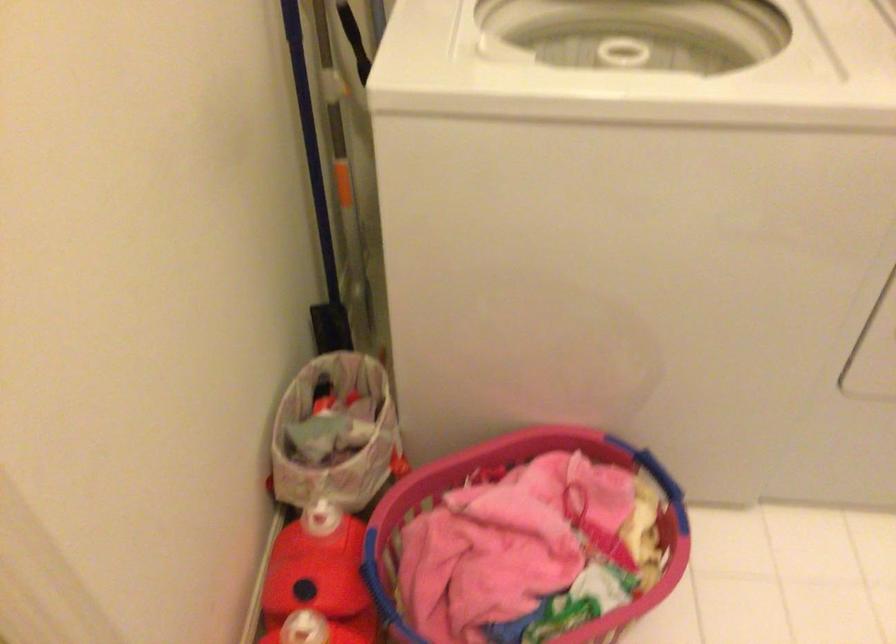
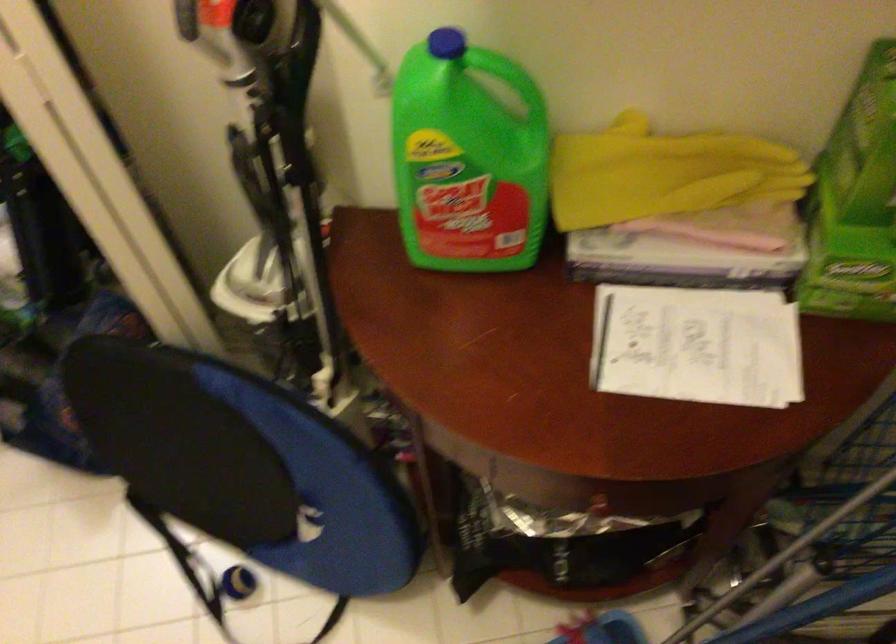
The images are taken continuously from a first-person perspective. In which direction is your viewpoint rotating?

The rotation direction of the camera is right-down.